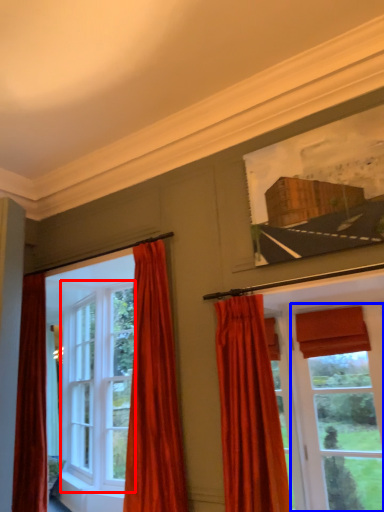
Question: Which object appears closest to the camera in this image, window (highlighted by a red box) or window (highlighted by a blue box)?

Choices:
 (A) window
 (B) window

Answer: (B)